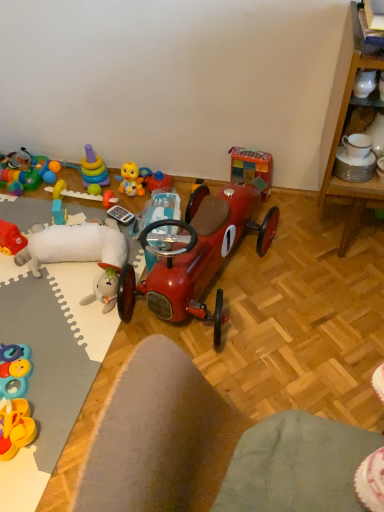
Identify the location of vacant region below wooden cabinet at right (from a real-world perspective). (339, 234).